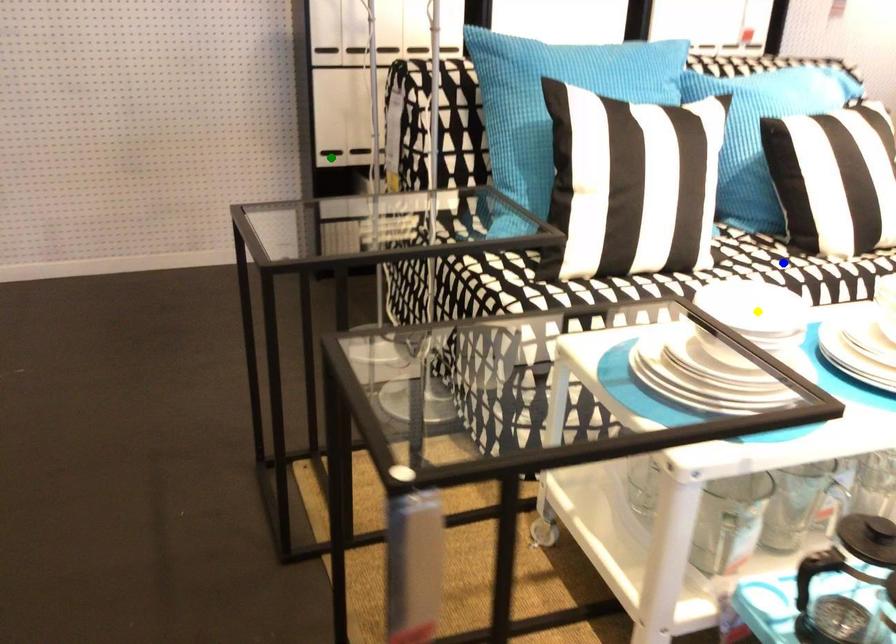
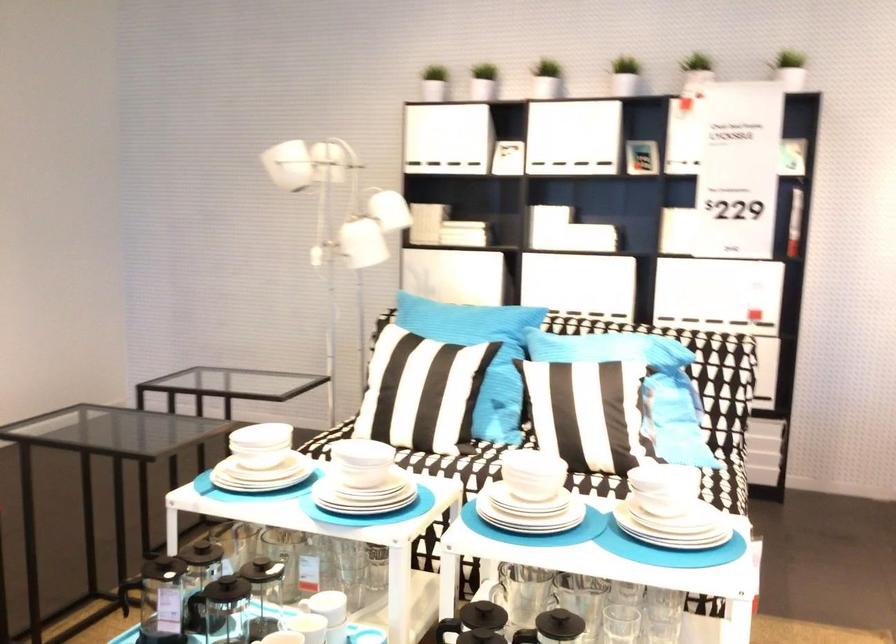
I am providing you with two images of the same scene from different viewpoints. Three points are marked in image1. Which point corresponds to a part or object that is occluded in image2?In image1, three points are marked. Which of them correspond to a part or object that is occluded in image2?Among the three points shown in image1, which one corresponds to a part or object that is no longer visible due to occlusion in image2?

green point, blue point, yellow point